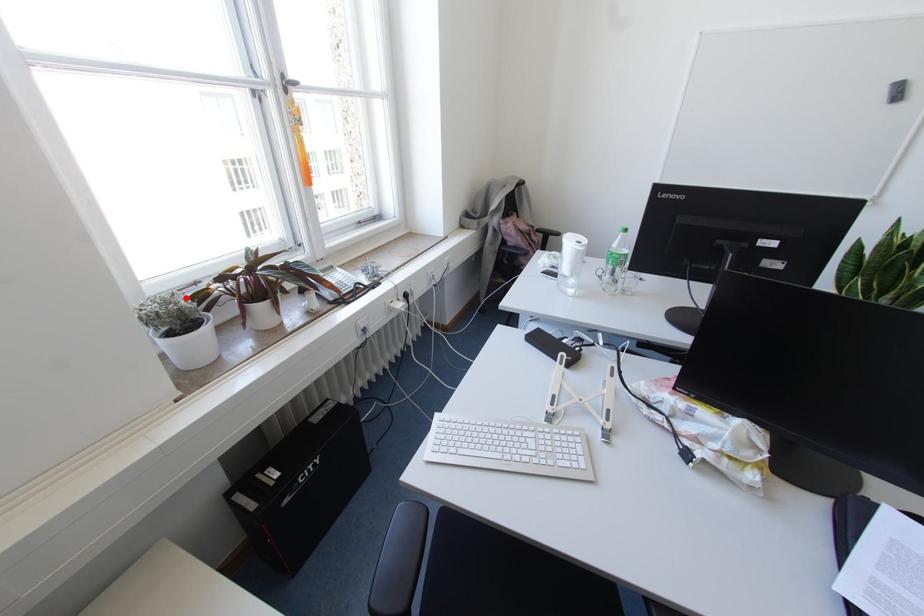
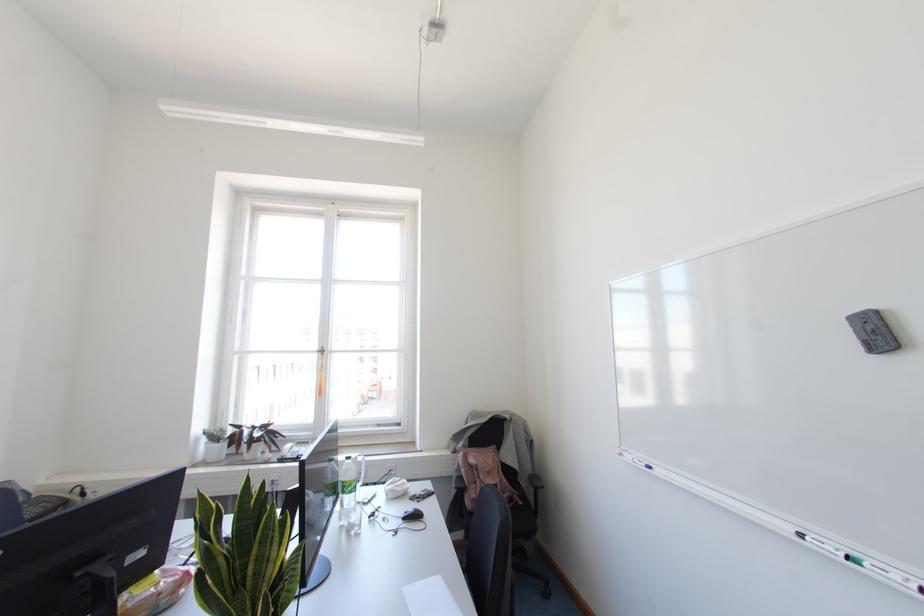
Where in the second image is the point corresponding to the highlighted location from the first image?

(223, 431)